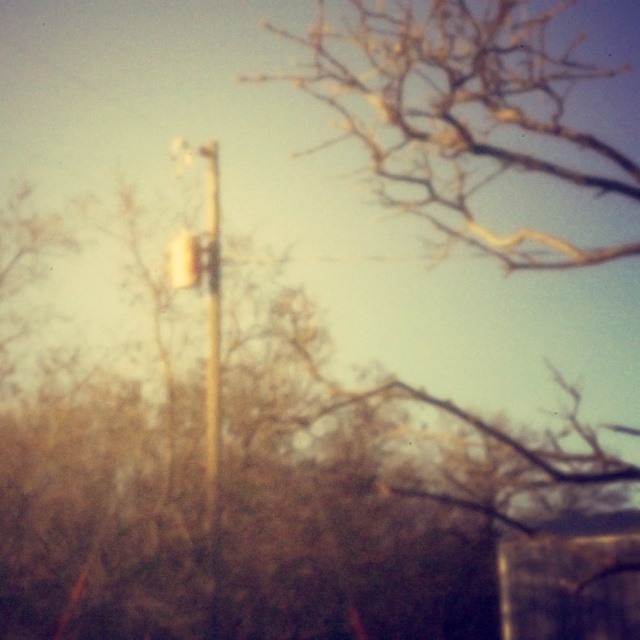
Question: Which point is closer to the camera taking this photo?

Choices:
 (A) (177, 260)
 (B) (212, 387)

Answer: (A)

Question: Can you confirm if wooden pole at center is bigger than metallic silver traffic light at center?

Choices:
 (A) no
 (B) yes

Answer: (B)

Question: Can you confirm if wooden pole at center is positioned above metallic silver traffic light at center?

Choices:
 (A) yes
 (B) no

Answer: (B)

Question: Is wooden pole at center above metallic silver traffic light at center?

Choices:
 (A) no
 (B) yes

Answer: (A)

Question: Which point appears closest to the camera in this image?

Choices:
 (A) (212, 316)
 (B) (170, 269)

Answer: (A)